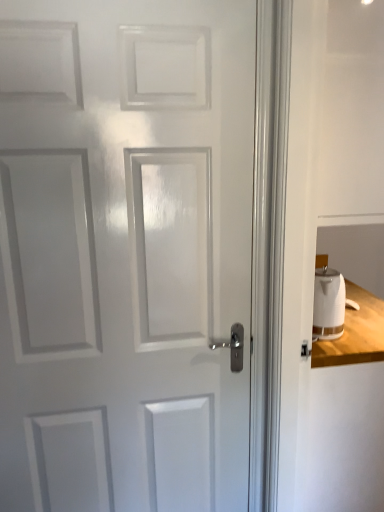
Question: In terms of height, does white glossy door at center look taller or shorter compared to white glossy electric kettle at right?

Choices:
 (A) tall
 (B) short

Answer: (A)

Question: From a real-world perspective, relative to white glossy electric kettle at right, is white glossy door at center vertically above or below?

Choices:
 (A) below
 (B) above

Answer: (B)

Question: Relative to white glossy electric kettle at right, is white glossy door at center in front or behind?

Choices:
 (A) behind
 (B) front

Answer: (B)

Question: From the image's perspective, is white glossy electric kettle at right positioned above or below white glossy door at center?

Choices:
 (A) below
 (B) above

Answer: (A)

Question: Is white glossy electric kettle at right spatially inside white glossy door at center, or outside of it?

Choices:
 (A) outside
 (B) inside

Answer: (A)

Question: Relative to white glossy door at center, is white glossy electric kettle at right in front or behind?

Choices:
 (A) behind
 (B) front

Answer: (A)

Question: Is white glossy electric kettle at right to the left or to the right of white glossy door at center in the image?

Choices:
 (A) left
 (B) right

Answer: (B)